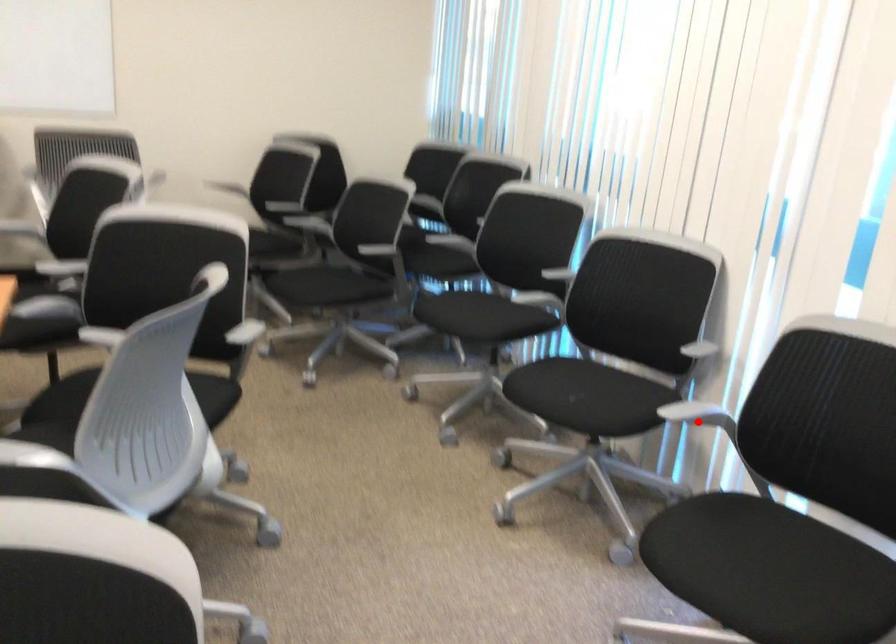
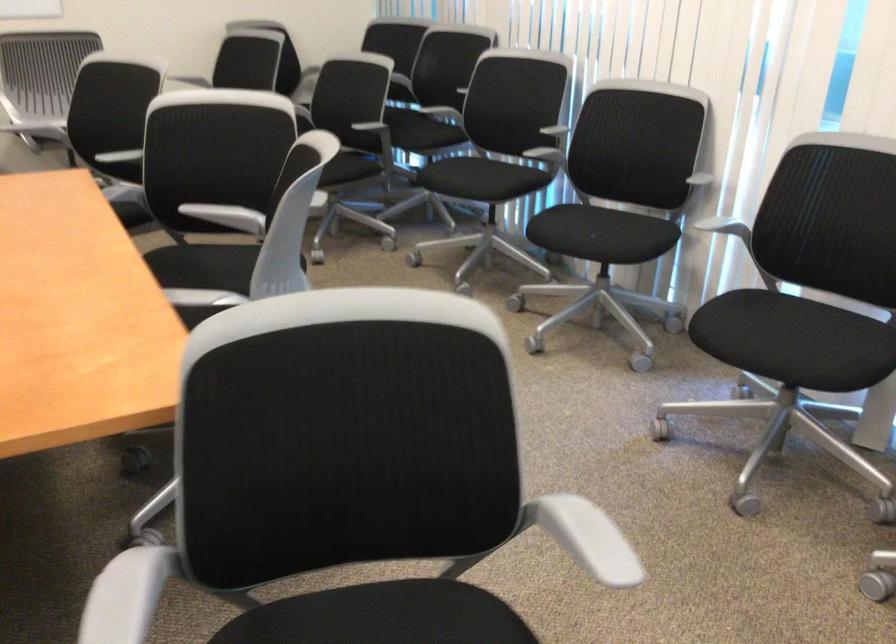
Question: I am providing you with two images of the same scene from different viewpoints. In image1, a red point is highlighted. Considering the same 3D point in image2, which of the following is correct?

Choices:
 (A) It is closer
 (B) It is farther

Answer: (B)